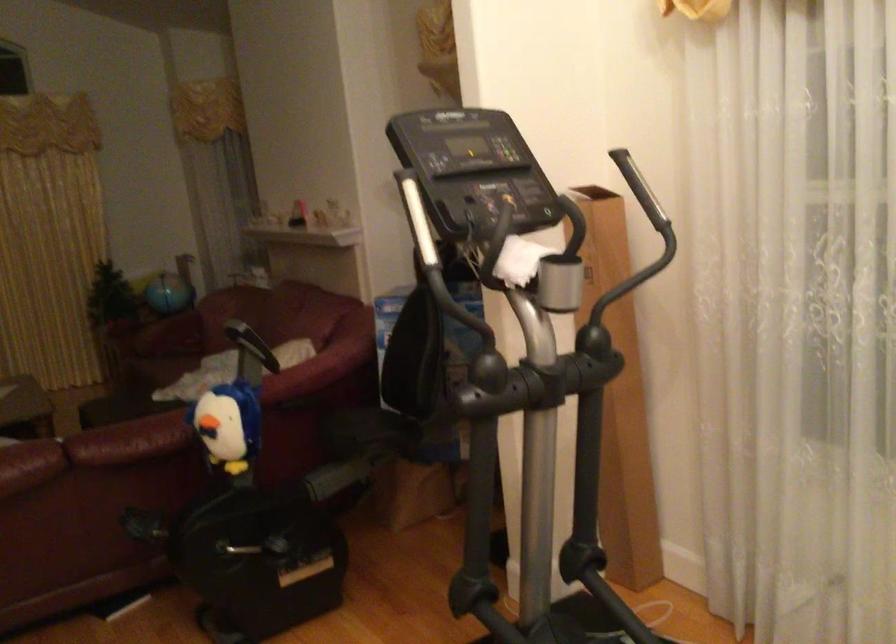
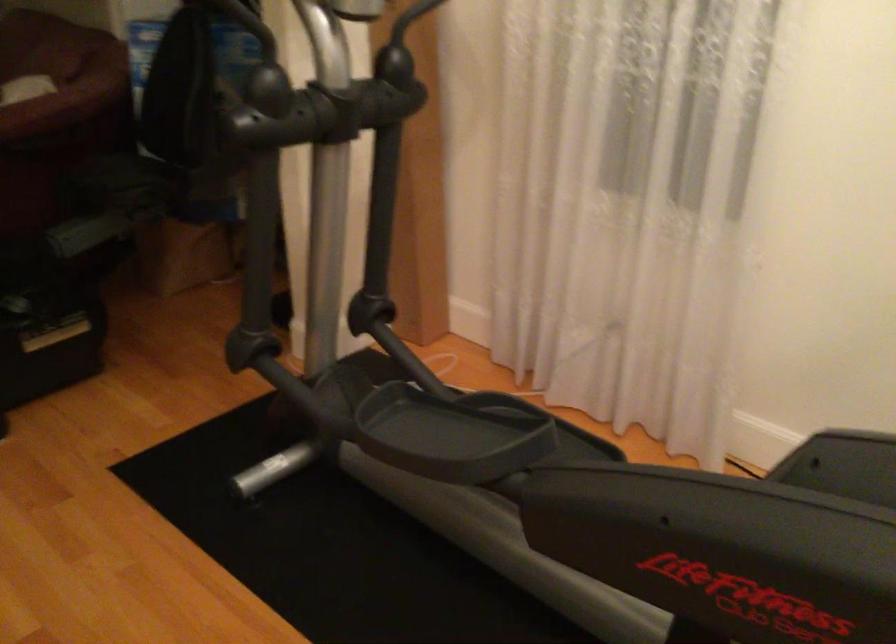
The first image is from the beginning of the video and the second image is from the end. How did the camera likely rotate when shooting the video?

The camera rotated toward right-down.